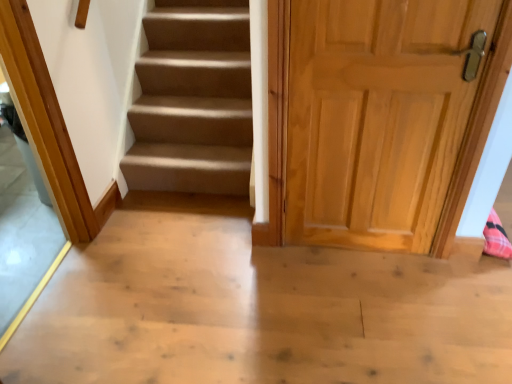
Question: Choose the correct answer: Is light brown wood door at right inside transparent glass door at left or outside it?

Choices:
 (A) inside
 (B) outside

Answer: (B)

Question: Considering the positions of light brown wood door at right and transparent glass door at left in the image, is light brown wood door at right taller or shorter than transparent glass door at left?

Choices:
 (A) tall
 (B) short

Answer: (B)

Question: Looking at their shapes, would you say light brown wood door at right is wider or thinner than transparent glass door at left?

Choices:
 (A) wide
 (B) thin

Answer: (B)

Question: From a real-world perspective, is transparent glass door at left positioned above or below light brown wood door at right?

Choices:
 (A) below
 (B) above

Answer: (B)

Question: Does point (59, 249) appear closer or farther from the camera than point (406, 198)?

Choices:
 (A) closer
 (B) farther

Answer: (B)

Question: Is transparent glass door at left bigger or smaller than light brown wood door at right?

Choices:
 (A) big
 (B) small

Answer: (A)

Question: Is transparent glass door at left taller or shorter than light brown wood door at right?

Choices:
 (A) tall
 (B) short

Answer: (A)